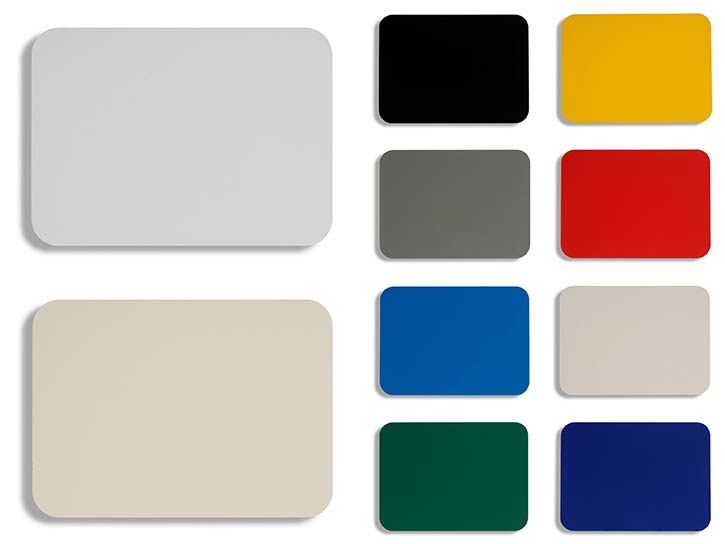
Locate an element on the screen. grey tile is located at coordinates (302, 467), (198, 92), (455, 213), (621, 338).